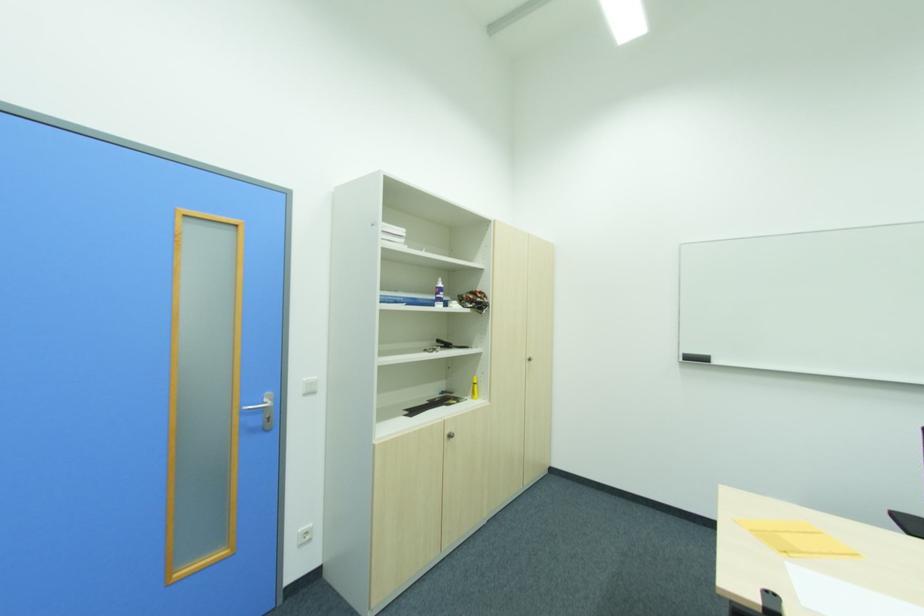
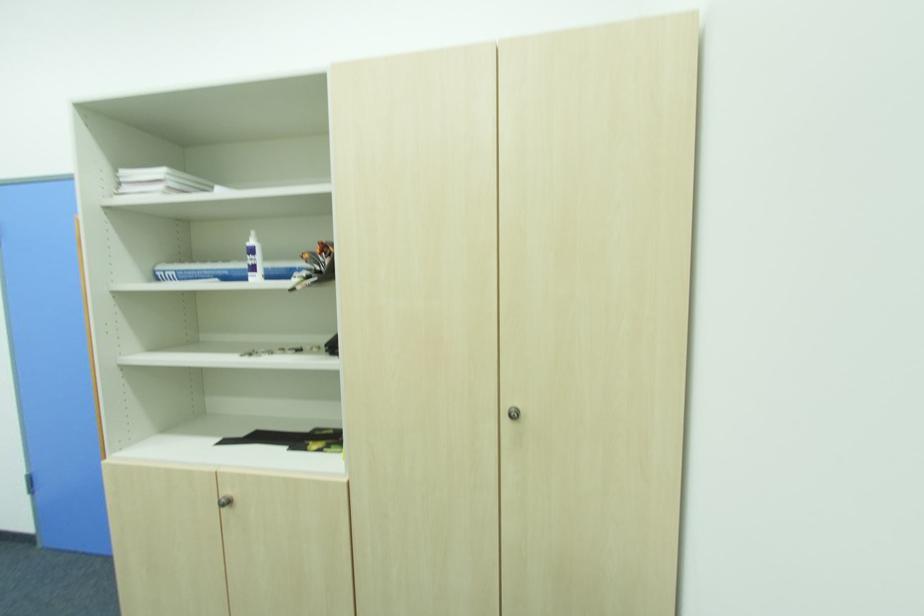
The point at (x=453, y=437) is marked in the first image. Where is the corresponding point in the second image?

(229, 504)